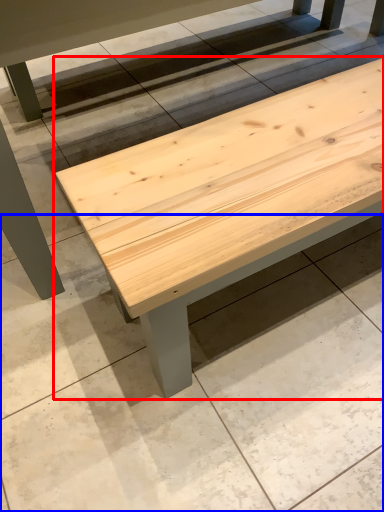
Question: Among these objects, which one is farthest to the camera, table (highlighted by a red box) or concrete (highlighted by a blue box)?

Choices:
 (A) table
 (B) concrete

Answer: (B)